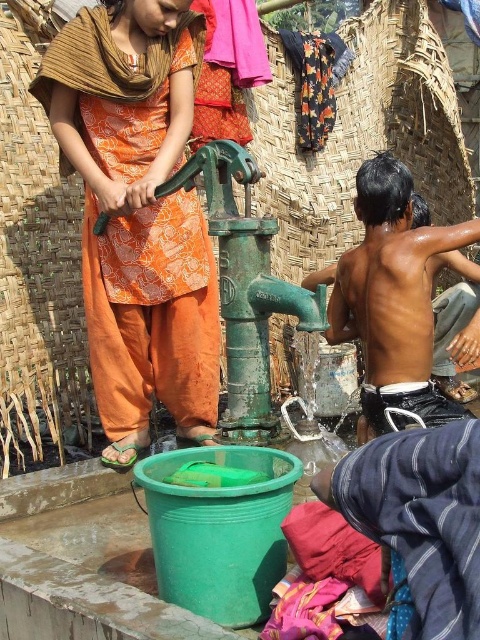
Question: Which of the following is the farthest from the observer?

Choices:
 (A) shiny black skin at right
 (B) orange printed fabric at center

Answer: (A)

Question: Is orange printed fabric at center wider than shiny black skin at right?

Choices:
 (A) no
 (B) yes

Answer: (B)

Question: Is orange printed fabric at center thinner than shiny black skin at right?

Choices:
 (A) yes
 (B) no

Answer: (B)

Question: Is orange printed fabric at center thinner than shiny black skin at right?

Choices:
 (A) yes
 (B) no

Answer: (B)

Question: Which point is farther to the camera?

Choices:
 (A) orange printed fabric at center
 (B) shiny black skin at right

Answer: (B)